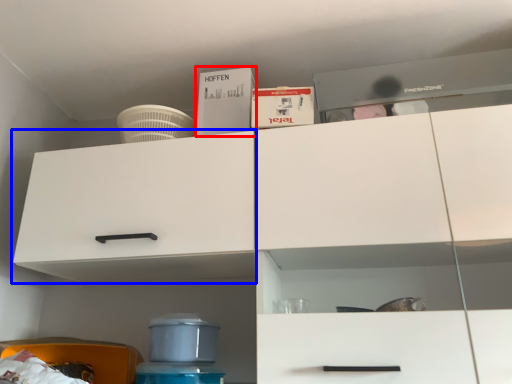
Question: Among these objects, which one is farthest to the camera, box (highlighted by a red box) or cabinetry (highlighted by a blue box)?

Choices:
 (A) box
 (B) cabinetry

Answer: (A)